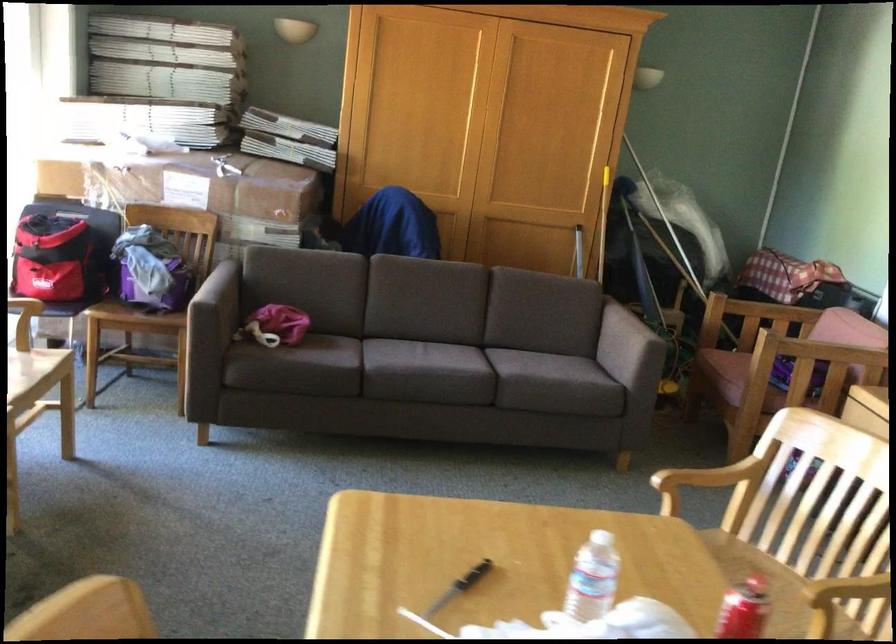
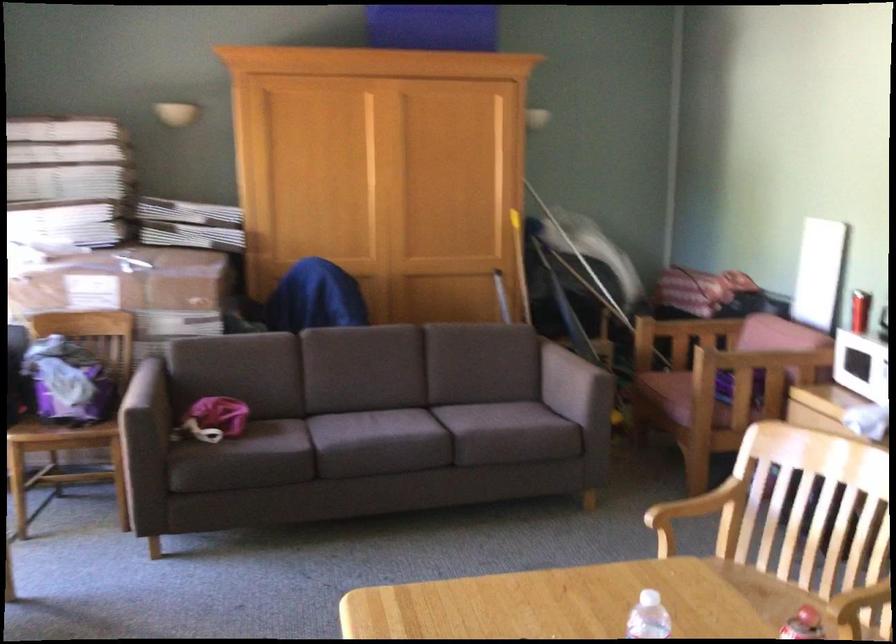
In the second image, find the point that corresponds to pixel 217 285 in the first image.

(144, 386)